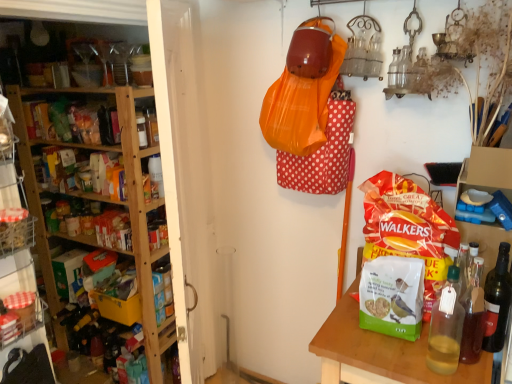
The image size is (512, 384). I want to click on free space in front of matte red bag of chips at right, so click(407, 355).